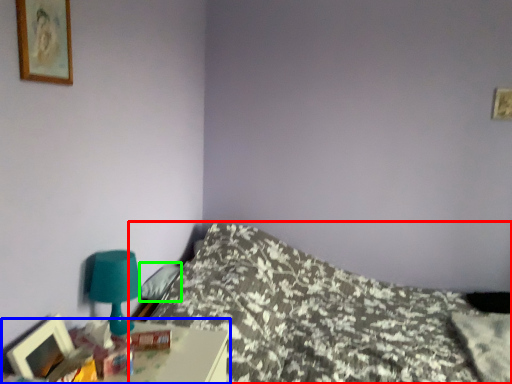
Question: Which object is the farthest from bed (highlighted by a red box)? Choose among these: nightstand (highlighted by a blue box) or pillow (highlighted by a green box).

Choices:
 (A) nightstand
 (B) pillow

Answer: (A)